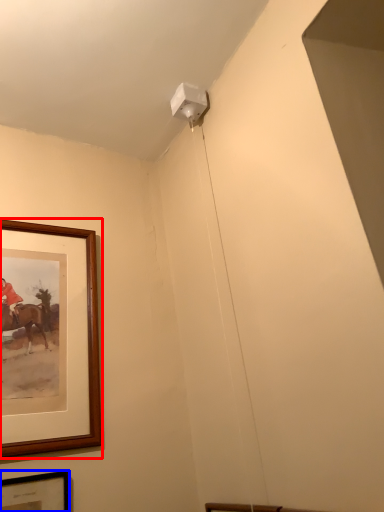
Question: Which of the following is the farthest to the observer, picture frame (highlighted by a red box) or picture frame (highlighted by a blue box)?

Choices:
 (A) picture frame
 (B) picture frame

Answer: (A)